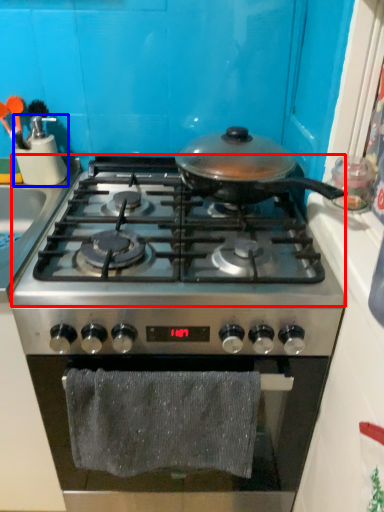
Question: Which object is closer to the camera taking this photo, gas stove (highlighted by a red box) or kitchen appliance (highlighted by a blue box)?

Choices:
 (A) gas stove
 (B) kitchen appliance

Answer: (A)